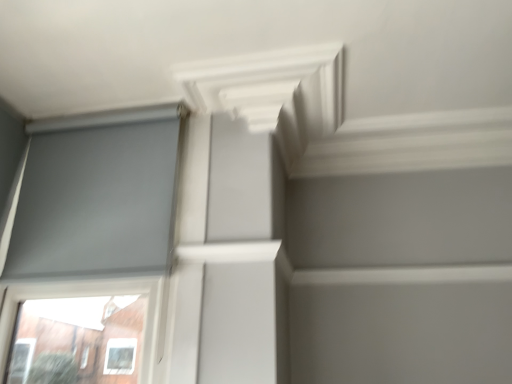
Question: Based on their sizes in the image, would you say white matte exhaust hood at upper center is bigger or smaller than matte gray screen at left?

Choices:
 (A) small
 (B) big

Answer: (A)

Question: Choose the correct answer: Is white matte exhaust hood at upper center inside matte gray screen at left or outside it?

Choices:
 (A) inside
 (B) outside

Answer: (B)

Question: From the image's perspective, relative to matte gray screen at left, is white matte exhaust hood at upper center above or below?

Choices:
 (A) above
 (B) below

Answer: (A)

Question: Is matte gray screen at left to the left or to the right of white matte exhaust hood at upper center in the image?

Choices:
 (A) left
 (B) right

Answer: (A)

Question: From the image's perspective, is matte gray screen at left positioned above or below white matte exhaust hood at upper center?

Choices:
 (A) above
 (B) below

Answer: (B)

Question: Is matte gray screen at left wider or thinner than white matte exhaust hood at upper center?

Choices:
 (A) wide
 (B) thin

Answer: (B)

Question: Choose the correct answer: Is matte gray screen at left inside white matte exhaust hood at upper center or outside it?

Choices:
 (A) outside
 (B) inside

Answer: (A)